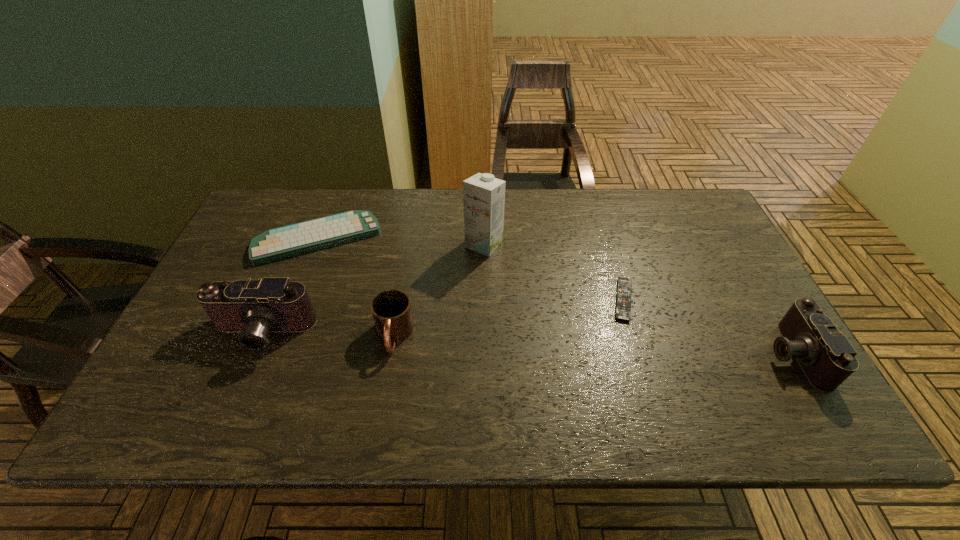
Where is `blank region between the rightmost object and the left camera`? This screenshot has height=540, width=960. blank region between the rightmost object and the left camera is located at coordinates (527, 343).

At what (x,y) coordinates should I click in order to perform the action: click on the second closest object relative to the right camera. Please return your answer as a coordinate pair (x, y). Looking at the image, I should click on (483, 195).

You are a GUI agent. You are given a task and a screenshot of the screen. Output one action in this format:
    pyautogui.click(x=<x>, y=<y>)
    Task: Click on the object that is the fifth nearest to the mug
    
    Given the screenshot: What is the action you would take?
    pos(826,356)